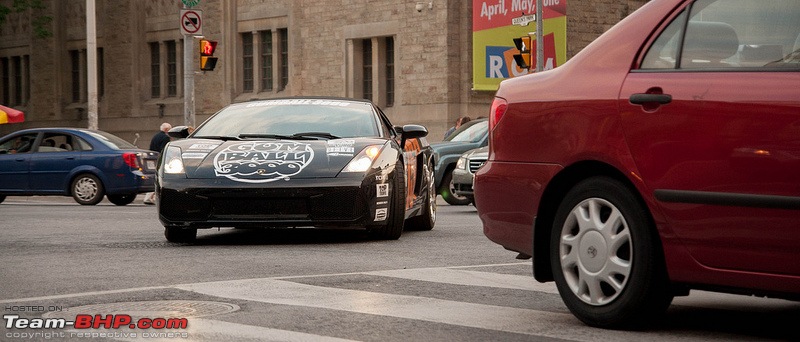
Where is `wall`? This screenshot has width=800, height=342. wall is located at coordinates (313, 58).